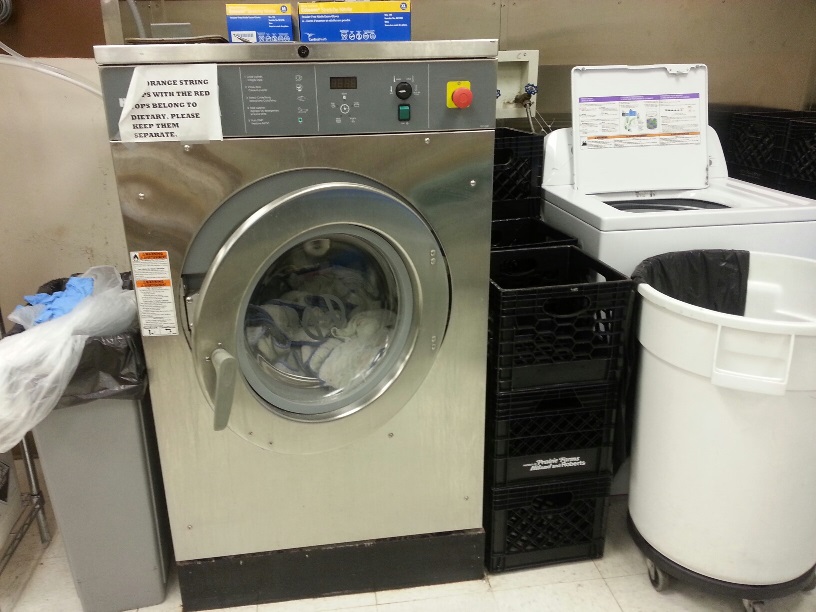
What are the coordinates of `washing machine` in the screenshot? It's located at (708, 217).